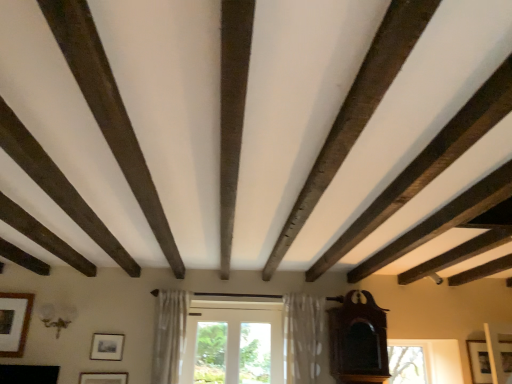
Question: In terms of height, does mahogany wood grandfather clock at right look taller or shorter compared to matte black picture frame at center, the second picture frame viewed from the left?

Choices:
 (A) short
 (B) tall

Answer: (B)

Question: Is mahogany wood grandfather clock at right in front of or behind matte black picture frame at center, the second picture frame viewed from the left, in the image?

Choices:
 (A) front
 (B) behind

Answer: (A)

Question: Based on their relative distances, which object is farther from the wooden picture frame at lower right, which is the fourth picture frame in left-to-right order?

Choices:
 (A) matte black picture frame at center, marked as the third picture frame in a right-to-left arrangement
 (B) sheer white curtain at center, which ranks as the 2th curtain in right-to-left order
 (C) clear glass window at lower right
 (D) wooden picture frame at lower left, which is the first picture frame in left-to-right order
 (E) mahogany wood grandfather clock at right

Answer: (D)

Question: Estimate the real-world distances between objects in this image. Which object is closer to the matte gold picture frame at lower center, which ranks as the third picture frame in left-to-right order?

Choices:
 (A) matte black picture frame at center, marked as the third picture frame in a right-to-left arrangement
 (B) clear glass window at lower right
 (C) mahogany wood grandfather clock at right
 (D) sheer white curtain at center, marked as the first curtain in a left-to-right arrangement
 (E) wooden picture frame at lower right, which is the fourth picture frame in left-to-right order

Answer: (A)